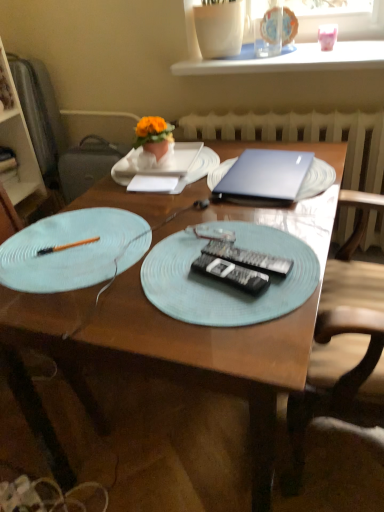
Identify the location of vacant area to the left of black plastic remote control at center, the second remote control in the top-to-bottom sequence. (153, 288).